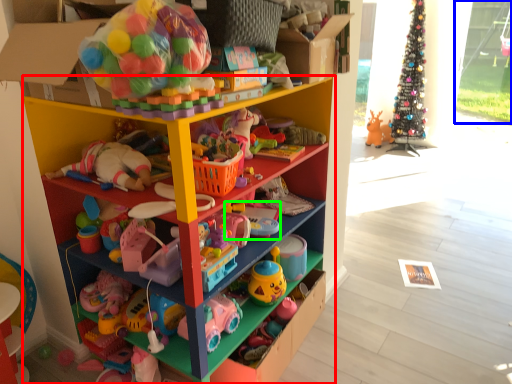
Question: Which object is positioned closest to shelf (highlighted by a red box)? Select from glass door (highlighted by a blue box) and toy (highlighted by a green box).

Choices:
 (A) glass door
 (B) toy

Answer: (B)